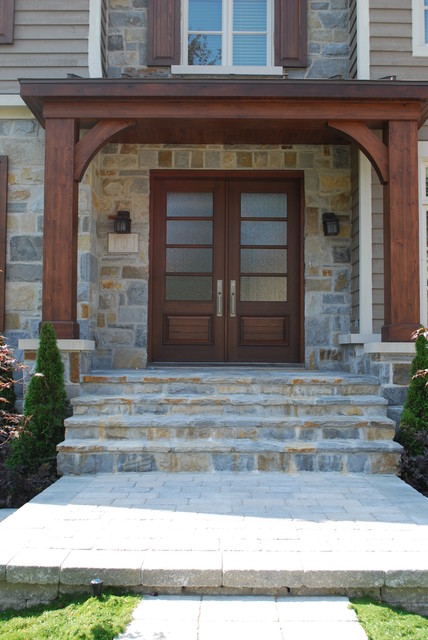
Find the location of a particular element. Image resolution: width=428 pixels, height=640 pixels. upper door frame is located at coordinates (218, 173).